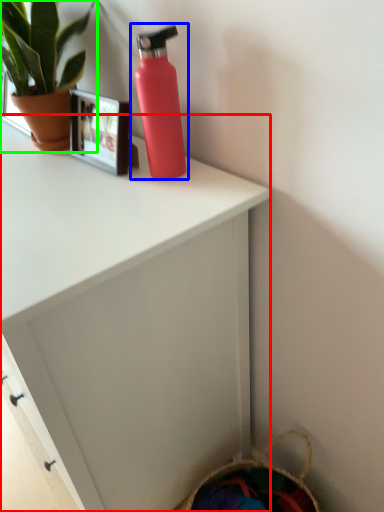
Question: Which is farther away from desk (highlighted by a red box)? bottle (highlighted by a blue box) or houseplant (highlighted by a green box)?

Choices:
 (A) bottle
 (B) houseplant

Answer: (B)